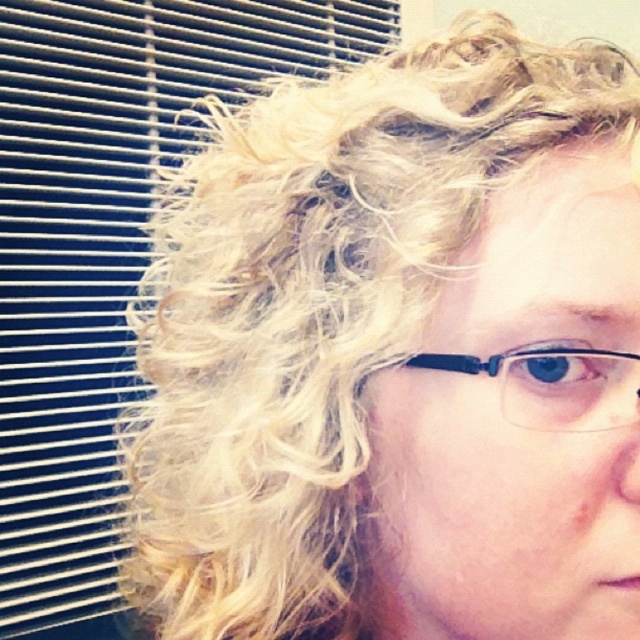
You are standing in front of the person in the image. There are two points marked on their face. One is at coordinates point (33, 392) and the other is at point (620, 413). Which point is closer to you?

Point (33, 392) is closer to you because it is further to the viewer than point (620, 413).

You are a makeup artist preparing to apply eyeliner to the person in the image. You notice the matte plastic hair at upper right and the clear plastic glasses at center. Which object is positioned higher on the person?

The matte plastic hair at upper right is much taller than clear plastic glasses at center, so the matte plastic hair at upper right is positioned higher on the person.

You are a photographer adjusting the focus of your camera. You want to ensure both the matte plastic hair at upper right and the clear plastic glasses at center are in focus. Given that your camera has a depth of field that can cover objects within 35 inches of each other, will both objects be in focus?

The matte plastic hair at upper right is 37.00 inches away from the clear plastic glasses at center. Since the distance between them exceeds the camera depth of field range of 35 inches, both objects cannot be in focus simultaneously.